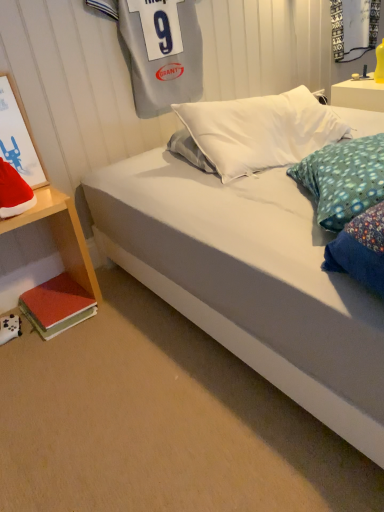
Question: Could you tell me if matte white picture frame at left is turned towards transparent glass shop window at upper right?

Choices:
 (A) no
 (B) yes

Answer: (A)

Question: Considering the relative sizes of matte white picture frame at left and transparent glass shop window at upper right in the image provided, is matte white picture frame at left bigger than transparent glass shop window at upper right?

Choices:
 (A) yes
 (B) no

Answer: (B)

Question: Is matte white picture frame at left at the right side of transparent glass shop window at upper right?

Choices:
 (A) no
 (B) yes

Answer: (A)

Question: Is matte white picture frame at left thinner than transparent glass shop window at upper right?

Choices:
 (A) yes
 (B) no

Answer: (B)

Question: Is matte white picture frame at left far from transparent glass shop window at upper right?

Choices:
 (A) no
 (B) yes

Answer: (B)

Question: Would you say transparent glass shop window at upper right is part of matte white picture frame at left's contents?

Choices:
 (A) no
 (B) yes

Answer: (A)

Question: Is matte white picture frame at left aimed at wooden nightstand at lower left, which is the 1th nightstand from front to back?

Choices:
 (A) no
 (B) yes

Answer: (A)

Question: From the image's perspective, does matte white picture frame at left appear higher than wooden nightstand at lower left, which is counted as the second nightstand, starting from the top?

Choices:
 (A) no
 (B) yes

Answer: (B)

Question: Does matte white picture frame at left appear on the left side of wooden nightstand at lower left, the second nightstand from the back?

Choices:
 (A) yes
 (B) no

Answer: (A)

Question: Is matte white picture frame at left positioned beyond the bounds of wooden nightstand at lower left, which is counted as the second nightstand, starting from the top?

Choices:
 (A) yes
 (B) no

Answer: (A)

Question: From a real-world perspective, is matte white picture frame at left on wooden nightstand at lower left, acting as the 2th nightstand starting from the right?

Choices:
 (A) no
 (B) yes

Answer: (B)

Question: Can you confirm if matte white picture frame at left is taller than wooden nightstand at lower left, acting as the 2th nightstand starting from the right?

Choices:
 (A) yes
 (B) no

Answer: (B)

Question: Does transparent glass shop window at upper right have a lesser height compared to matte white picture frame at left?

Choices:
 (A) no
 (B) yes

Answer: (B)